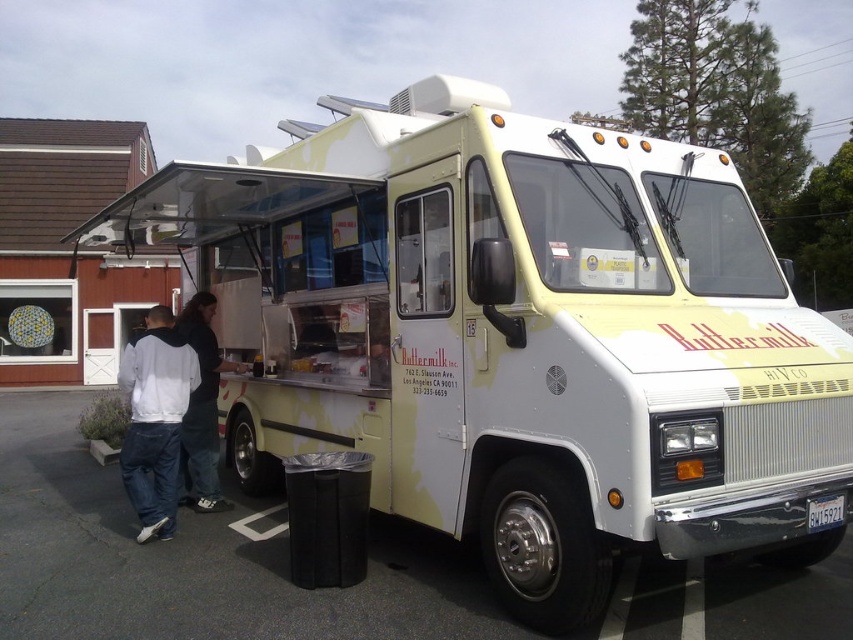
Question: Is white asphalt at lower left below white cotton shirt at left?

Choices:
 (A) no
 (B) yes

Answer: (B)

Question: Does white hoodie at left have a lesser width compared to white cotton shirt at left?

Choices:
 (A) no
 (B) yes

Answer: (A)

Question: Which object is positioned farthest from the white cotton shirt at left?

Choices:
 (A) white asphalt at lower left
 (B) white hoodie at left

Answer: (A)

Question: Is white asphalt at lower left bigger than white cotton shirt at left?

Choices:
 (A) yes
 (B) no

Answer: (A)

Question: Which of the following is the closest to the observer?

Choices:
 (A) (131, 468)
 (B) (10, 561)
 (C) (192, 317)

Answer: (B)

Question: Among these objects, which one is farthest from the camera?

Choices:
 (A) white cotton shirt at left
 (B) white hoodie at left
 (C) white asphalt at lower left

Answer: (A)